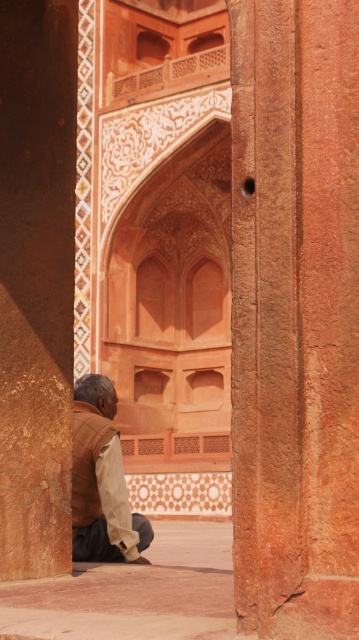
You are standing in the historical structure and notice two points marked in the scene. The first point is at coordinates point [291,525] and the second is at point [122,483]. Which point is nearer to your current position?

Point [291,525] is closer to the camera than point [122,483], so the first point is nearer to your current position.

You are standing in the historical structure and want to take a photo of the rustic stone pillar at center and the brown cotton shirt at lower left. Which object should you focus on first to ensure both are in the frame without moving the camera?

You should focus on the rustic stone pillar at center first because it is closer to the viewer than the brown cotton shirt at lower left, so adjusting focus starting from the closer object will help keep both in the frame.